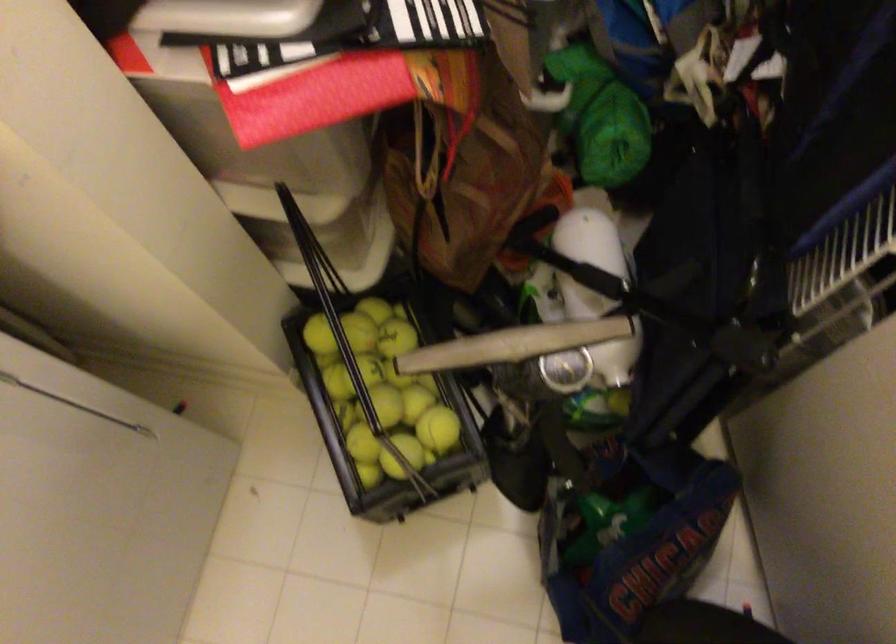
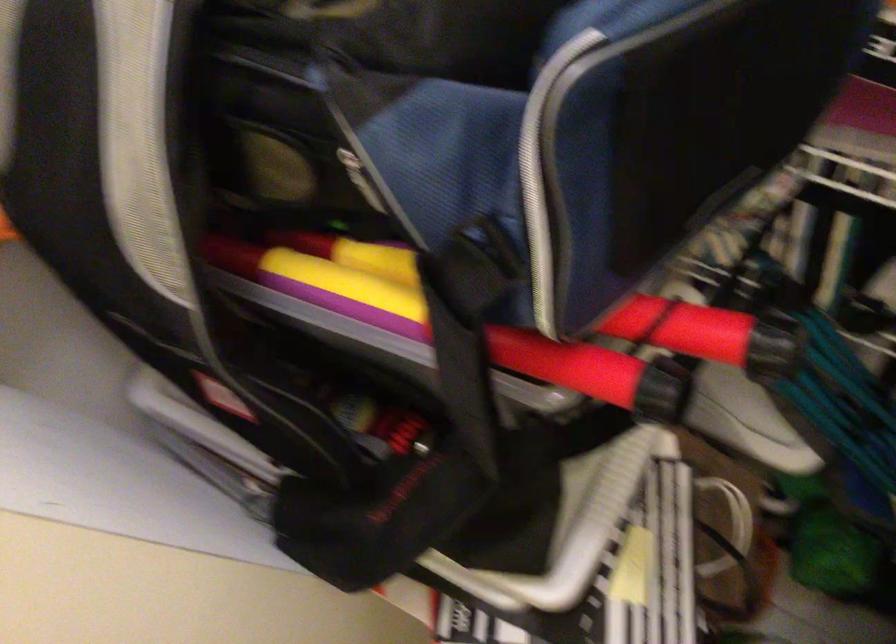
Question: The camera is either moving clockwise (left) or counter-clockwise (right) around the object. The first image is from the beginning of the video and the second image is from the end. Is the camera moving left or right when shooting the video?

Choices:
 (A) Left
 (B) Right

Answer: (B)